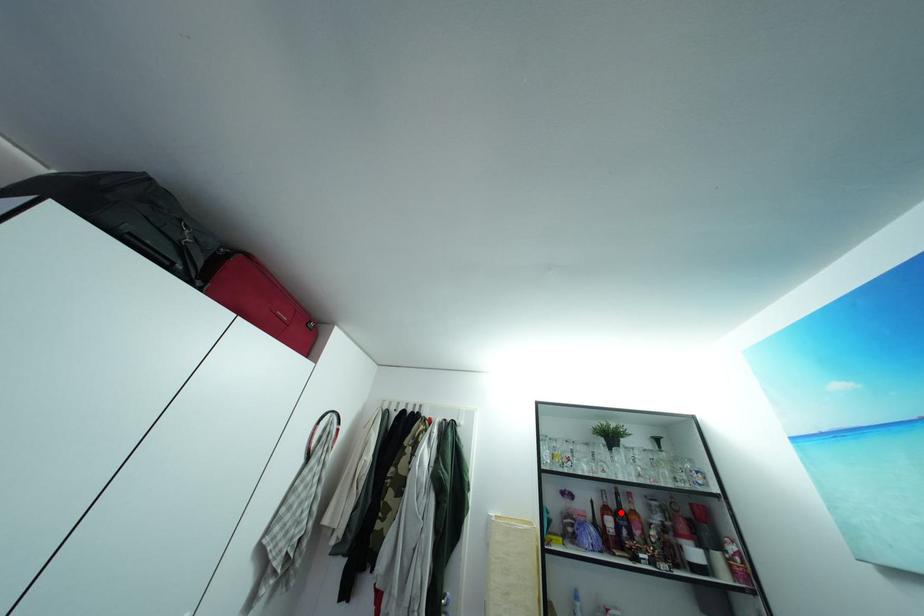
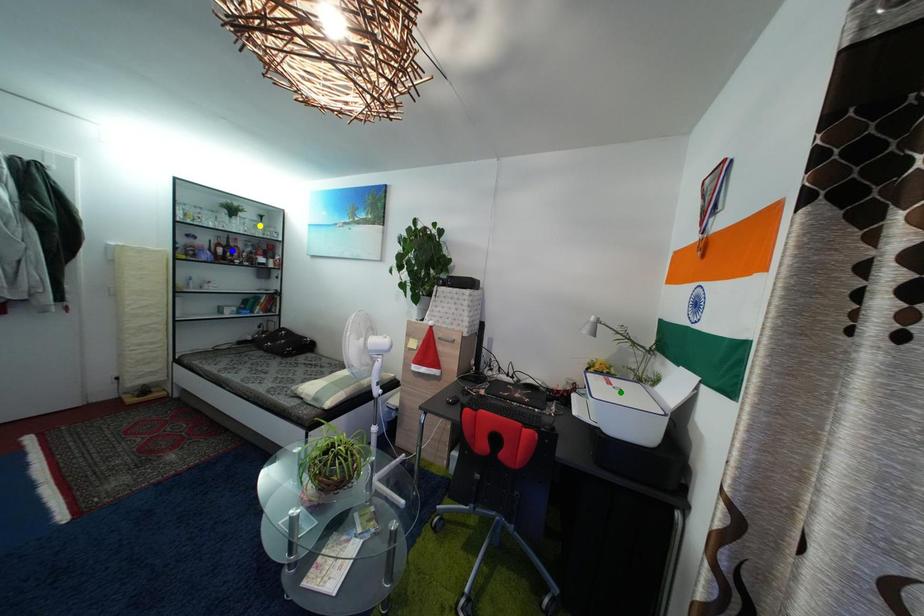
Question: I am providing you with two images of the same scene from different viewpoints. A red point is marked on the first image. You are given multiple points on the second image. Which point in image 2 is actually the same real-world point as the red point in image 1?

Choices:
 (A) yellow point
 (B) green point
 (C) blue point

Answer: (C)